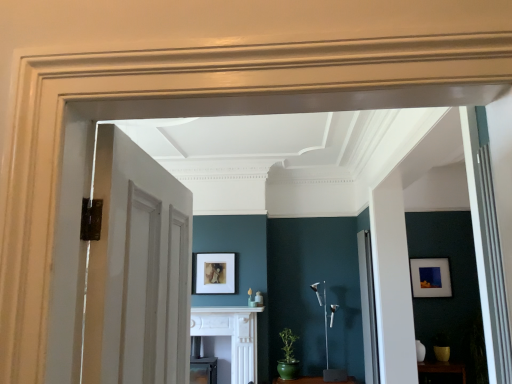
Question: Considering their positions, is brown wooden shelf at lower right located in front of or behind matte gold picture frame at center, the first picture frame positioned from the left?

Choices:
 (A) behind
 (B) front

Answer: (B)

Question: Is point (431, 364) positioned closer to the camera than point (216, 284)?

Choices:
 (A) farther
 (B) closer

Answer: (B)

Question: Which object is positioned closest to the matte gold picture frame at center, which is the second picture frame from back to front?

Choices:
 (A) white marble fireplace at center
 (B) brown wooden shelf at lower right
 (C) white glossy door at right, which is counted as the 1th door, starting from the bottom
 (D) matte black picture frame at right, the second picture frame when ordered from left to right
 (E) green matte pot at lower center

Answer: (A)

Question: Which of these objects is positioned closest to the white wood door at left, arranged as the second door when viewed from the back?

Choices:
 (A) white glossy fireplace at center
 (B) green matte pot at lower center
 (C) brown wooden shelf at lower right
 (D) white marble fireplace at center
 (E) white glossy door at right, which is the 2th door from top to bottom

Answer: (E)